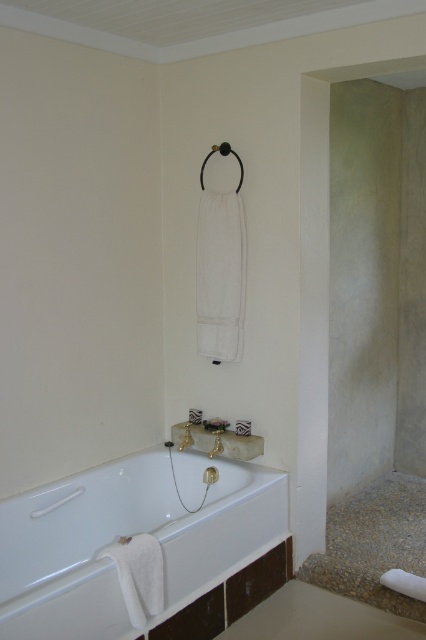
Question: Which of the following is the closest to the observer?

Choices:
 (A) white glossy bathtub at lower left
 (B) white fabric towel bar at upper center

Answer: (A)

Question: Is white glossy bathtub at lower left below white fabric towel bar at upper center?

Choices:
 (A) no
 (B) yes

Answer: (A)

Question: Is white glossy bathtub at lower left to the left of white fabric towel bar at upper center from the viewer's perspective?

Choices:
 (A) yes
 (B) no

Answer: (A)

Question: Does white glossy bathtub at lower left have a smaller size compared to white fabric towel bar at upper center?

Choices:
 (A) no
 (B) yes

Answer: (A)

Question: Which of the following is the farthest from the observer?

Choices:
 (A) white glossy bathtub at lower left
 (B) white fabric towel bar at upper center

Answer: (B)